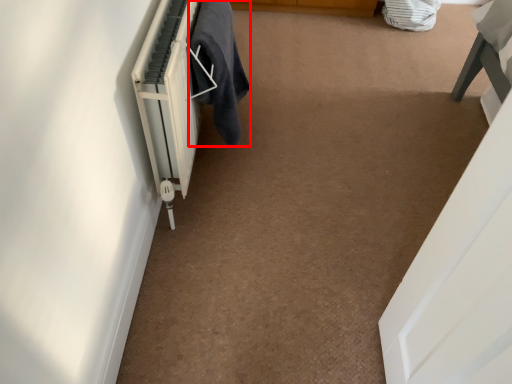
Question: From the image's perspective, what is the correct spatial relationship of laundry (annotated by the red box) in relation to radiator?

Choices:
 (A) above
 (B) below

Answer: (A)